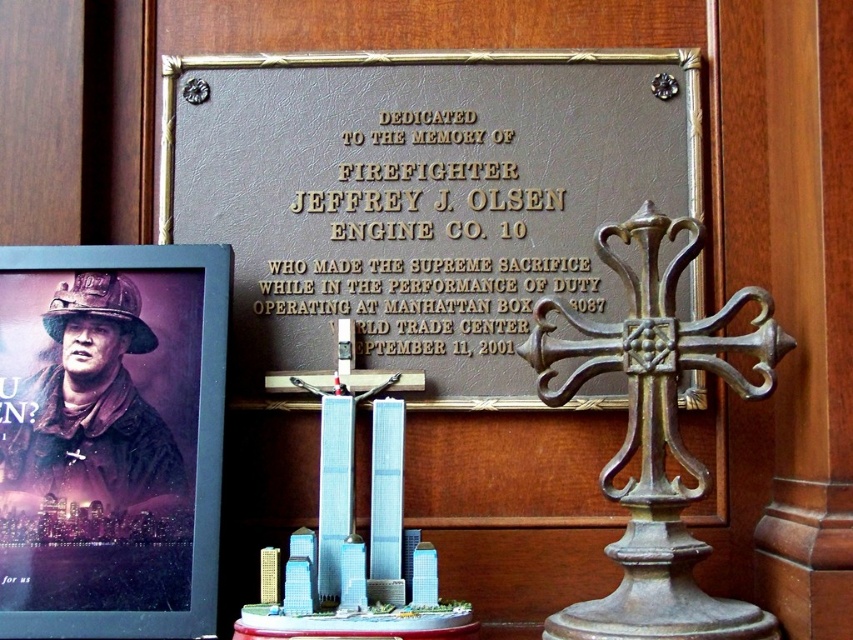
Question: Is brown leather plaque at center behind matte black poster at left?

Choices:
 (A) no
 (B) yes

Answer: (B)

Question: Which object appears closest to the camera in this image?

Choices:
 (A) brown leather plaque at center
 (B) matte black poster at left

Answer: (B)

Question: Does brown leather plaque at center have a greater width compared to matte black poster at left?

Choices:
 (A) no
 (B) yes

Answer: (B)

Question: Which object is farther from the camera taking this photo?

Choices:
 (A) brown leather plaque at center
 (B) matte black poster at left

Answer: (A)

Question: Does brown leather plaque at center have a larger size compared to matte black poster at left?

Choices:
 (A) no
 (B) yes

Answer: (B)

Question: Among these points, which one is farthest from the camera?

Choices:
 (A) (289, 154)
 (B) (173, 474)

Answer: (A)